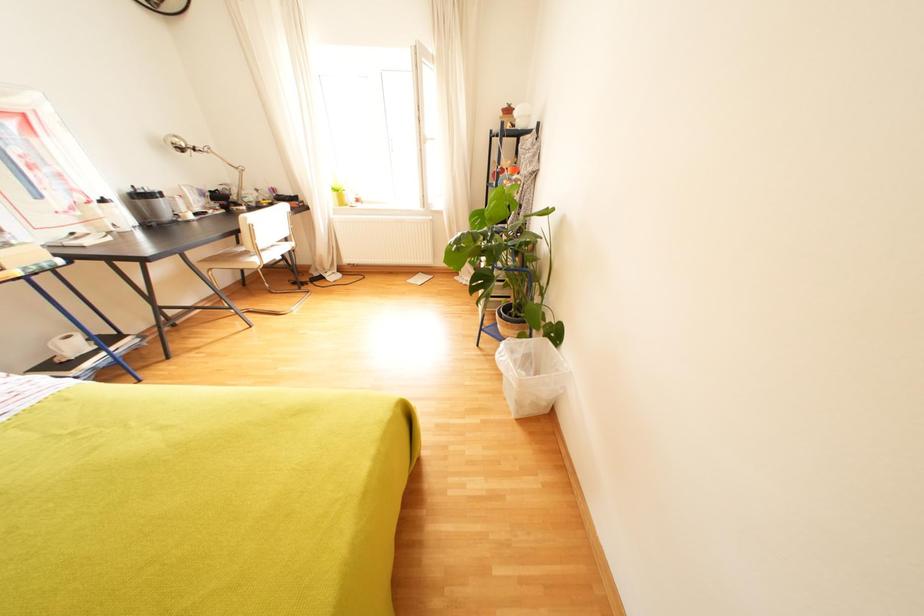
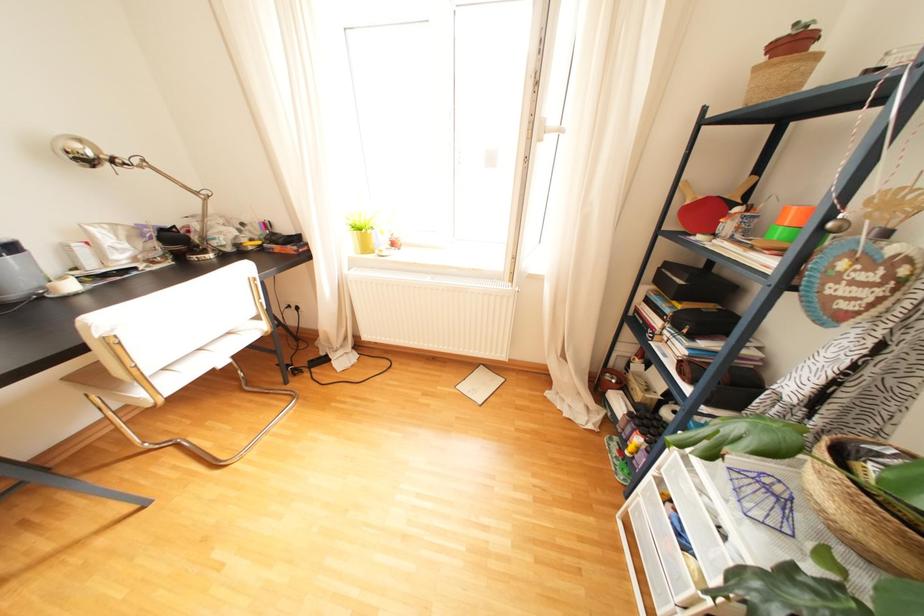
Question: In a continuous first-person perspective shot, in which direction is the camera moving?

Choices:
 (A) Left
 (B) Right
 (C) Forward
 (D) Backward

Answer: (C)